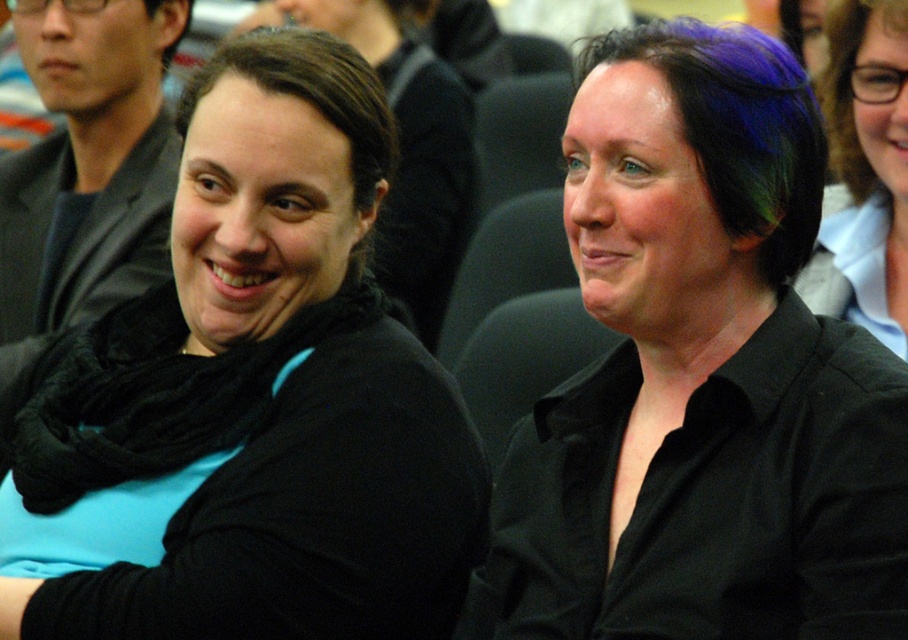
You are a photographer trying to capture a closeup shot of the black matte shirt at center and the brown curly hair at upper right. Which object should you focus on first if you want to ensure both are in focus without adjusting the camera settings?

The black matte shirt at center is larger in size than the brown curly hair at upper right, so focusing on the larger object first would help maintain focus on both when adjusting the camera settings.

You are sitting at point (788, 253) and want to see someone at point (117, 99). Can you see them without moving?

Point (117, 99) is behind point (788, 253), so you cannot see them without moving.